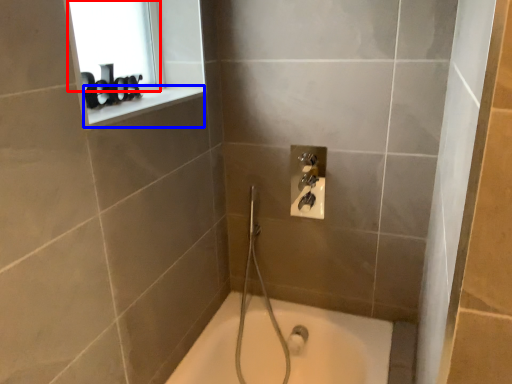
Question: Which object appears farthest to the camera in this image, window screen (highlighted by a red box) or window sill (highlighted by a blue box)?

Choices:
 (A) window screen
 (B) window sill

Answer: (A)